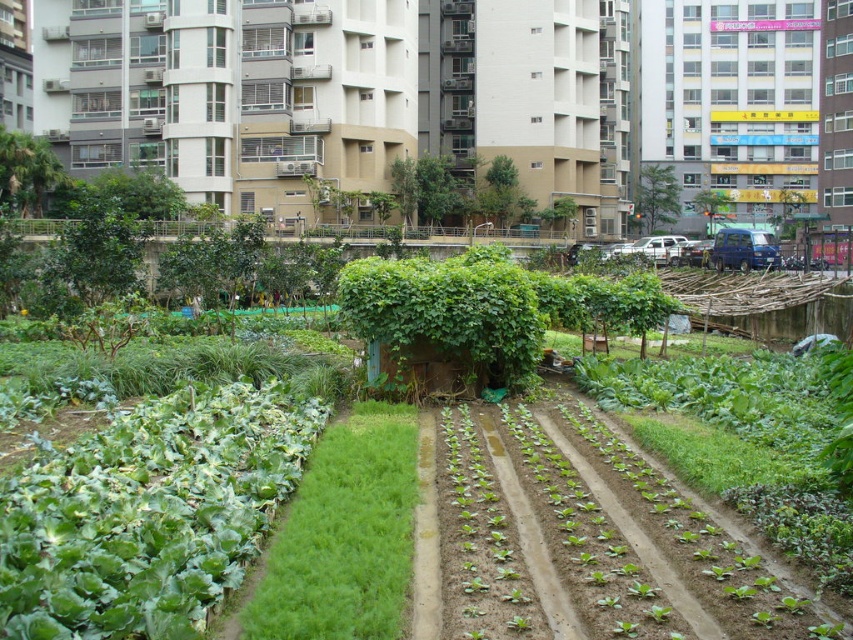
Question: Which point is closer to the camera?

Choices:
 (A) green leafy vegetables at center
 (B) green leafy grass at center

Answer: (B)

Question: Can you confirm if green leafy vegetables at center is positioned above green leafy grass at center?

Choices:
 (A) no
 (B) yes

Answer: (A)

Question: Is green leafy vegetables at center below green leafy grass at center?

Choices:
 (A) yes
 (B) no

Answer: (A)

Question: Can you confirm if green leafy vegetables at center is wider than green leafy grass at center?

Choices:
 (A) yes
 (B) no

Answer: (B)

Question: Which of the following is the farthest from the observer?

Choices:
 (A) (258, 628)
 (B) (167, 570)

Answer: (B)